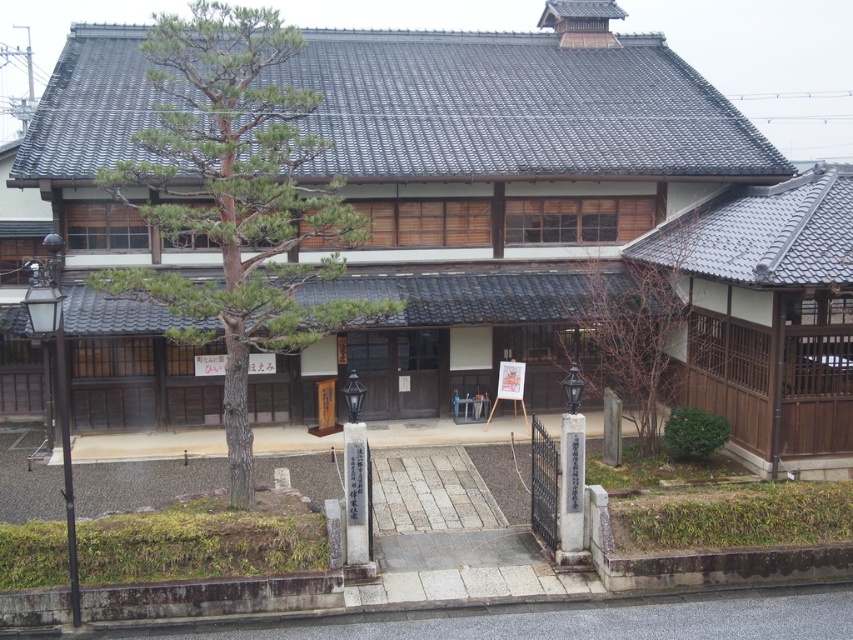
Question: Is green textured pine tree at center below bare wood tree at center?

Choices:
 (A) no
 (B) yes

Answer: (A)

Question: Is green textured pine tree at center positioned in front of bare wood tree at center?

Choices:
 (A) yes
 (B) no

Answer: (A)

Question: Can you confirm if green textured pine tree at center is positioned above bare wood tree at center?

Choices:
 (A) yes
 (B) no

Answer: (A)